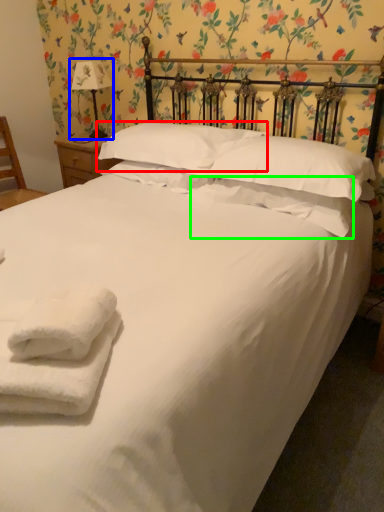
Question: Which object is the closest to the pillow (highlighted by a red box)? Choose among these: table lamp (highlighted by a blue box) or pillow (highlighted by a green box).

Choices:
 (A) table lamp
 (B) pillow

Answer: (B)